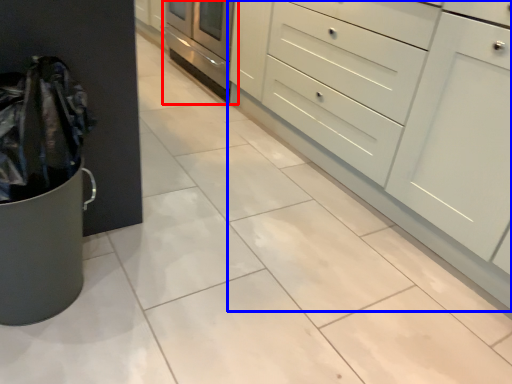
Question: Which of the following is the closest to the observer, oven (highlighted by a red box) or chest of drawers (highlighted by a blue box)?

Choices:
 (A) oven
 (B) chest of drawers

Answer: (B)